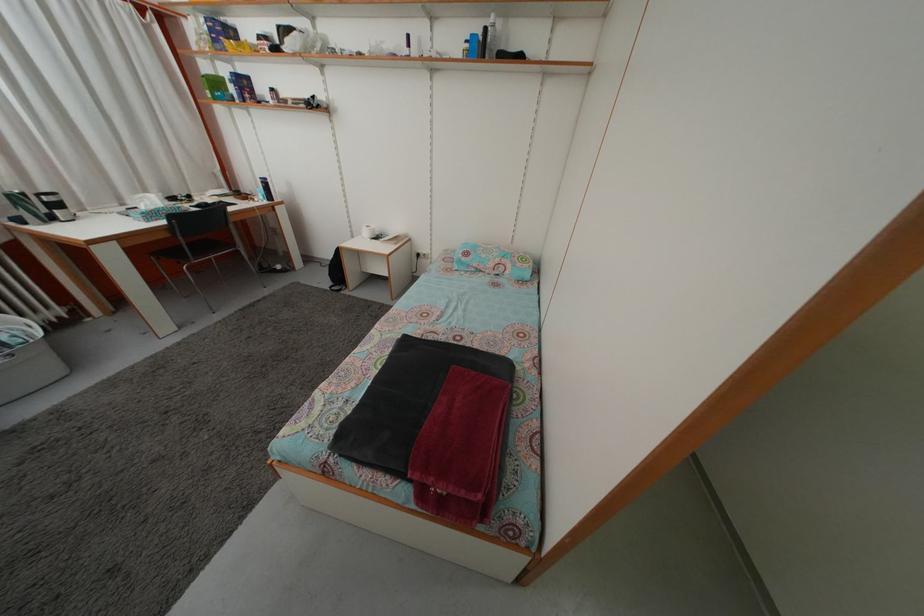
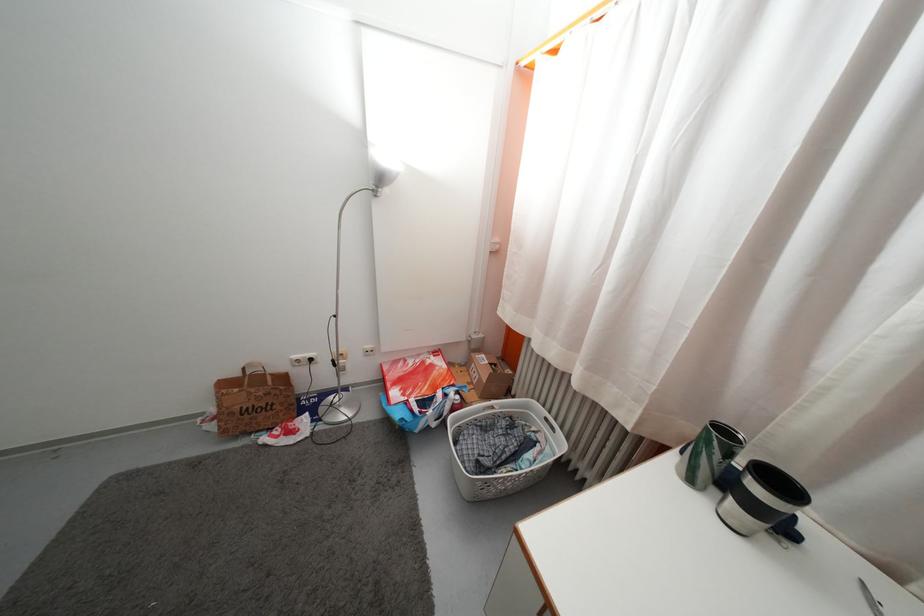
Locate, in the second image, the point that corresponds to (x=51, y=229) in the first image.

(697, 488)